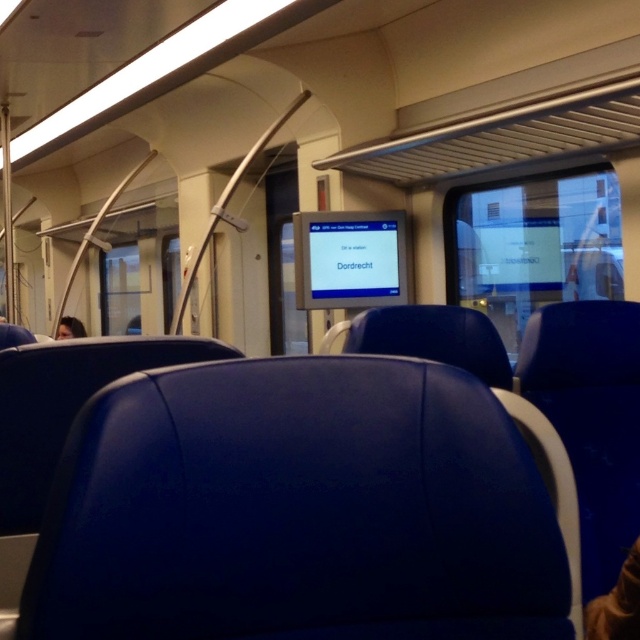
You are a passenger in the train carriage and want to know how far the matte blue seat at center is from your current position. Can you determine the distance?

The matte blue seat at center is 29.23 inches away from the camera, so it is approximately 29.23 inches away from your current position if you are at the camera viewpoint.

You are a passenger sitting in the train carriage and want to reach the destination displayed on the screen. You notice two points marked in the carriage. From your seat, which point is closer to the front of the train? The points are located at coordinates point (132,573) and point (58,320).

Point (132,573) is in front of point (58,320), so it is closer to the front of the train.